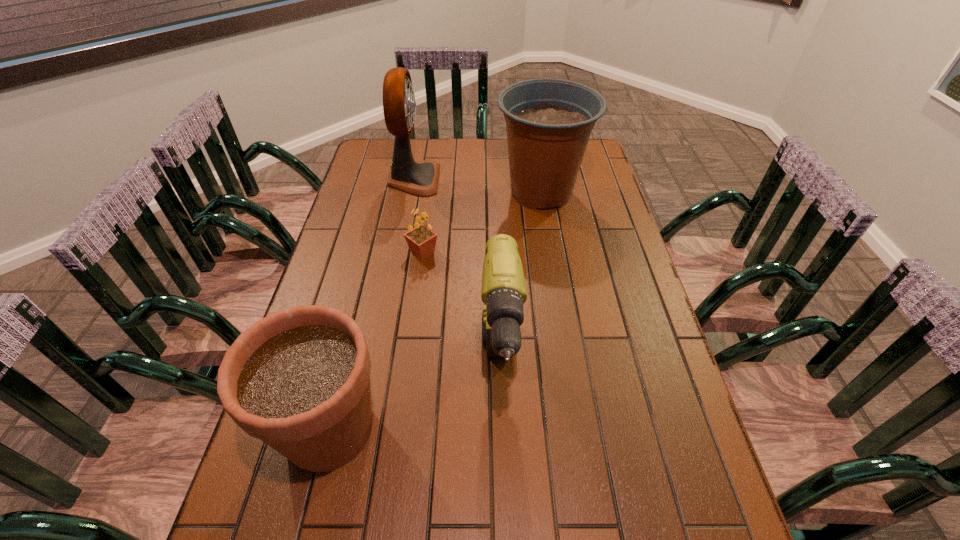
I want to click on vacant area at the far edge of the desktop, so click(x=482, y=142).

The height and width of the screenshot is (540, 960). I want to click on free space at the left edge of the desktop, so click(x=339, y=252).

In the image, there is a desktop. In order to click on vacant space at the right edge in this screenshot , I will do `click(651, 418)`.

This screenshot has width=960, height=540. I want to click on vacant space at the far right corner of the desktop, so click(598, 160).

Locate an element on the screen. This screenshot has height=540, width=960. vacant area between the farther flowerpot and the fan is located at coordinates (477, 186).

This screenshot has width=960, height=540. Identify the location of empty location between the taller flowerpot and the nearer flowerpot. (435, 311).

The height and width of the screenshot is (540, 960). Identify the location of free space that is in between the drill and the sunflower. (461, 311).

Where is `vacant space that is in between the tallest object and the drill`? Image resolution: width=960 pixels, height=540 pixels. vacant space that is in between the tallest object and the drill is located at coordinates 457,274.

At what (x,y) coordinates should I click in order to perform the action: click on vacant region between the drill and the left flowerpot. Please return your answer as a coordinate pair (x, y). The height and width of the screenshot is (540, 960). Looking at the image, I should click on (415, 399).

Where is `free space between the shortest object and the right flowerpot`? The width and height of the screenshot is (960, 540). free space between the shortest object and the right flowerpot is located at coordinates (482, 222).